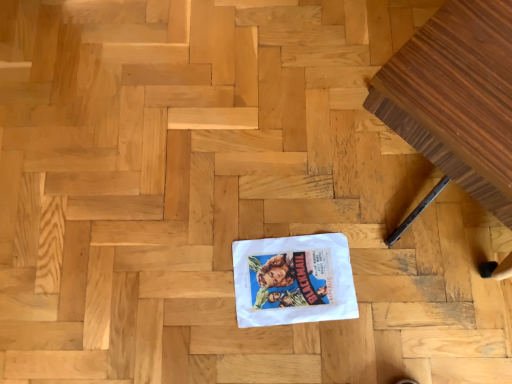
Where is `free point below wooden piano at right (from a real-world perspective)`? The image size is (512, 384). free point below wooden piano at right (from a real-world perspective) is located at coordinates (420, 198).